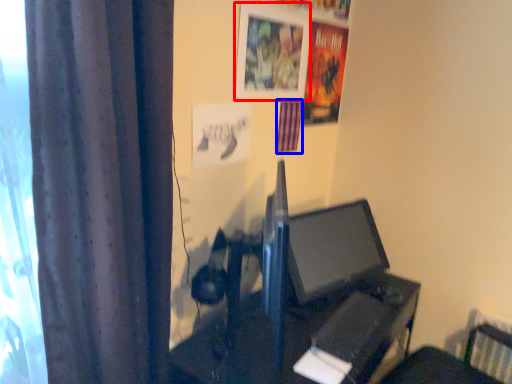
Question: Which point is closer to the camera, picture frame (highlighted by a red box) or poster page (highlighted by a blue box)?

Choices:
 (A) picture frame
 (B) poster page

Answer: (A)